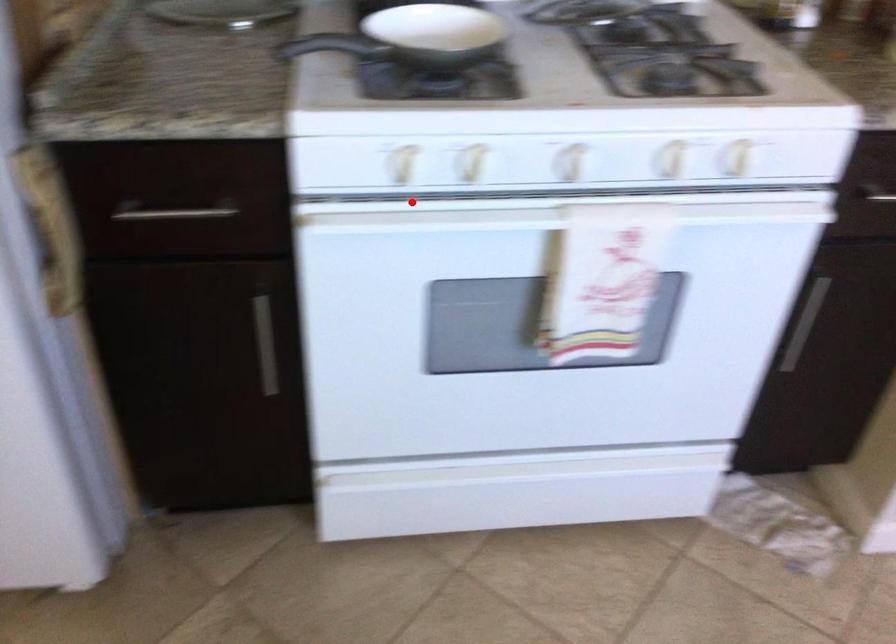
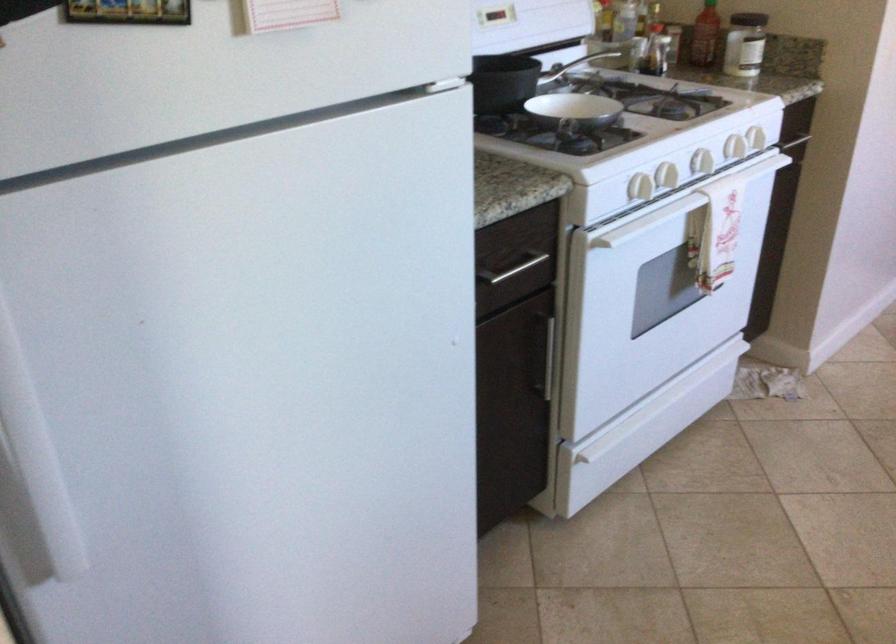
The point at the highlighted location is marked in the first image. Where is the corresponding point in the second image?

(666, 176)